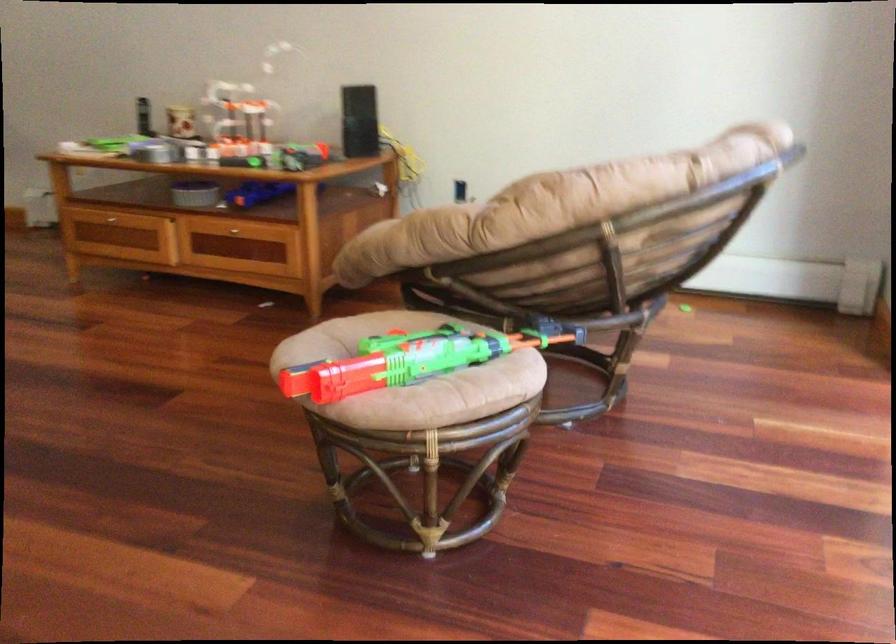
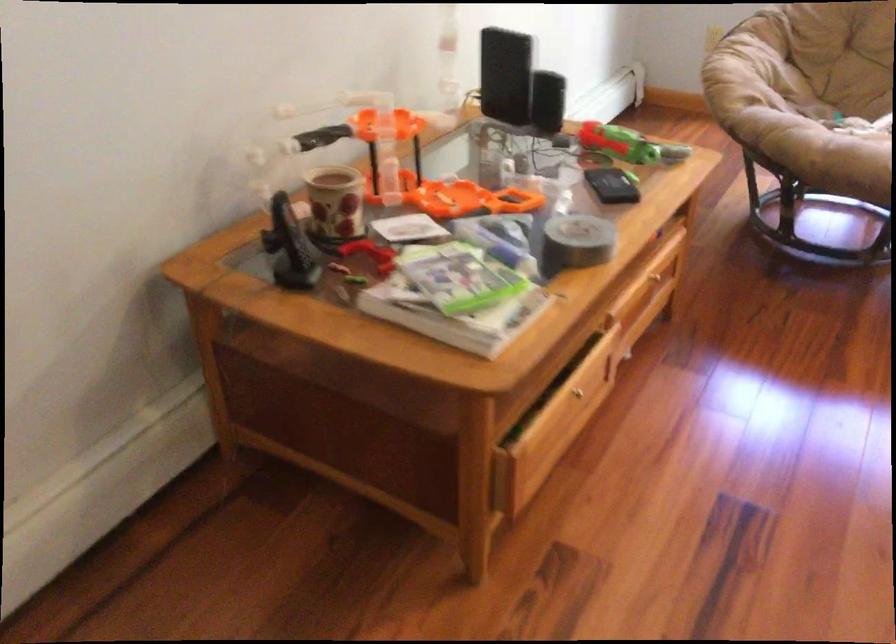
Locate, in the second image, the point that corresponds to [231,232] in the first image.

(653, 277)